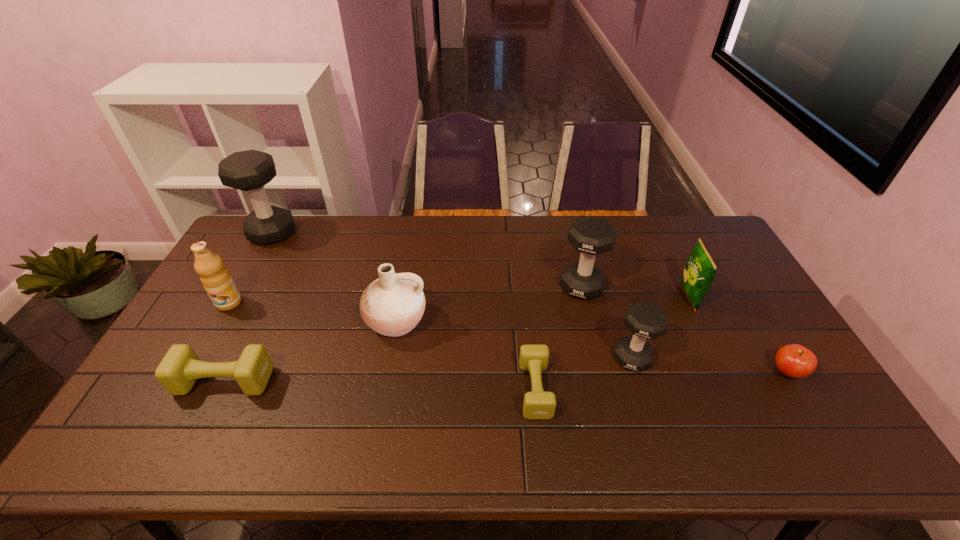
Find the location of a particular element. This screenshot has width=960, height=540. vacant point located 0.120m on the front-facing side of the crisp (potato chip) is located at coordinates (643, 296).

Identify the location of free space located 0.260m on the front-facing side of the crisp (potato chip). The width and height of the screenshot is (960, 540). (599, 296).

This screenshot has height=540, width=960. I want to click on vacant area situated on the front-facing side of the crisp (potato chip), so click(602, 296).

This screenshot has width=960, height=540. In order to click on blank space located on the front of the nearest gray dumbbell in this screenshot , I will do `click(648, 411)`.

The image size is (960, 540). Identify the location of vacant space situated on the back of the left olive dumbbell. (279, 271).

Image resolution: width=960 pixels, height=540 pixels. I want to click on vacant space located on the back of the apple, so click(729, 275).

You are a GUI agent. You are given a task and a screenshot of the screen. Output one action in this format:
    pyautogui.click(x=<x>, y=<y>)
    Task: Click on the vacant space located on the back of the shortest dumbbell
    
    Given the screenshot: What is the action you would take?
    pyautogui.click(x=529, y=330)

I want to click on object that is at the far edge, so click(250, 170).

Where is `olive oil at the left edge`? Image resolution: width=960 pixels, height=540 pixels. olive oil at the left edge is located at coordinates [216, 279].

You are a GUI agent. You are given a task and a screenshot of the screen. Output one action in this format:
    pyautogui.click(x=<x>, y=<y>)
    Task: Click on the object that is at the right edge
    
    Given the screenshot: What is the action you would take?
    pyautogui.click(x=793, y=360)